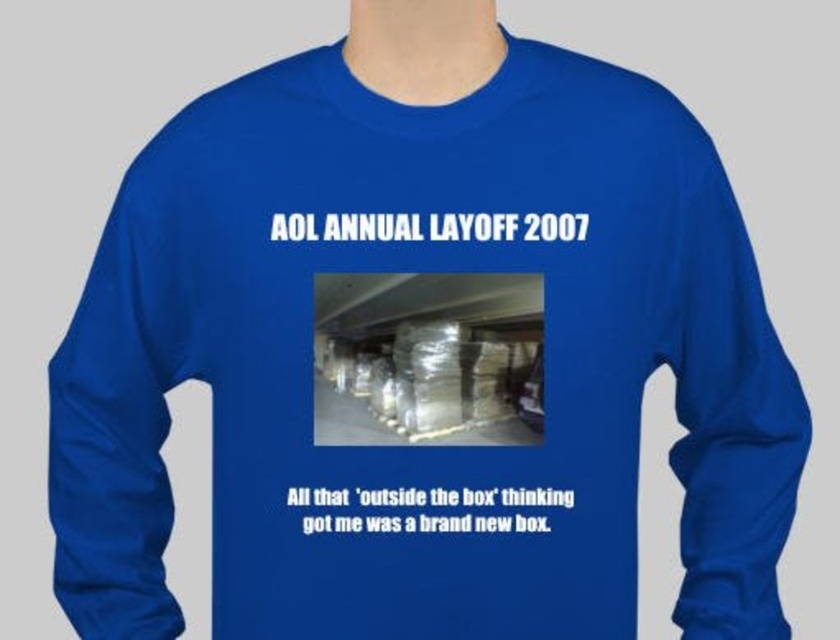
Where is `royal blue fabric sleeve at left`? royal blue fabric sleeve at left is located at coordinates (117, 428).

Is royal blue fabric sleeve at left above royal blue fabric sleeve at right?

No, royal blue fabric sleeve at left is not above royal blue fabric sleeve at right.

Is point (109, 260) positioned after point (754, 580)?

Yes.

Identify the location of royal blue fabric sleeve at left. (117, 428).